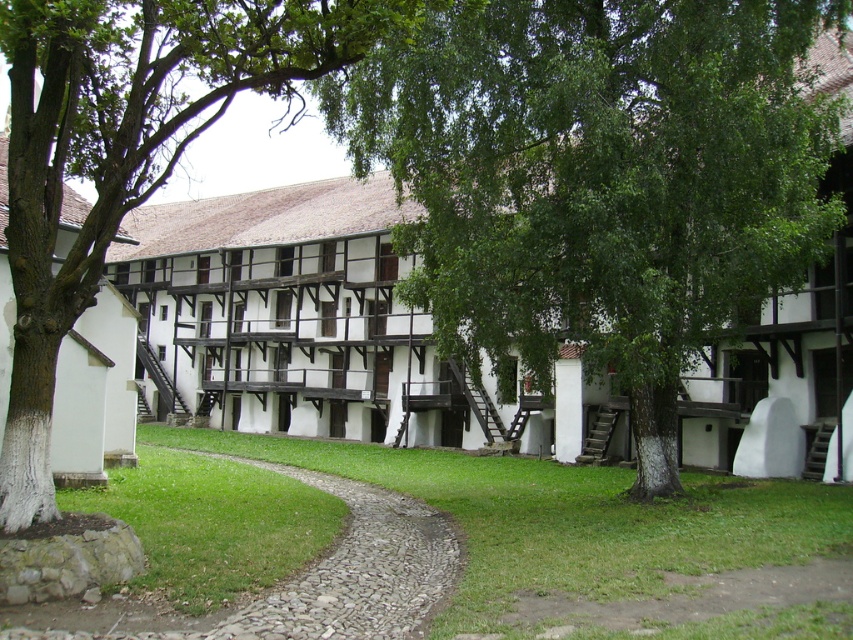
You are planning to walk from the entrance of the building to the garden area. The entrance is located at the gray gravel path at center. The garden area is marked by the green grass at center. Which path should you take if you want to choose the wider route?

The green grass at center is wider than the gray gravel path at center, so you should take the green grass at center path.